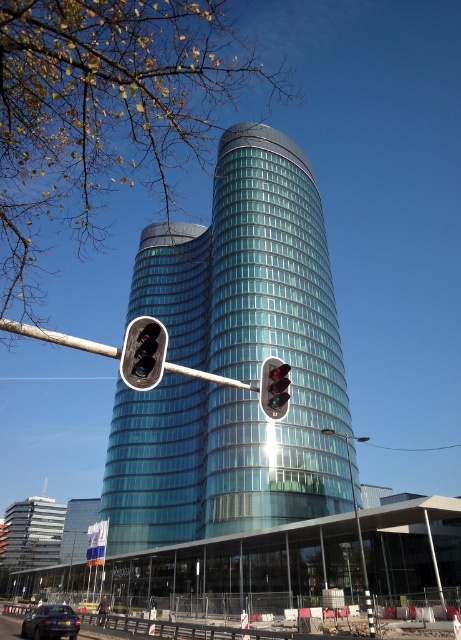
Is glassy teal skyscraper at center to the right of metallic traffic light at left from the viewer's perspective?

Correct, you'll find glassy teal skyscraper at center to the right of metallic traffic light at left.

In the scene shown: Can you confirm if glassy teal skyscraper at center is positioned above metallic traffic light at left?

Correct, glassy teal skyscraper at center is located above metallic traffic light at left.

Is point (193, 456) behind point (30, 326)?

Yes, point (193, 456) is farther from viewer.

What are the coordinates of `glassy teal skyscraper at center` in the screenshot? It's located at (232, 362).

Does point (78, 625) come behind point (278, 417)?

Yes, it is behind point (278, 417).

Does point (27, 636) come in front of point (267, 408)?

No, (27, 636) is behind (267, 408).

Is point (57, 624) closer to viewer compared to point (270, 410)?

No, it is not.

The height and width of the screenshot is (640, 461). Identify the location of metallic blue sedan at lower left. (51, 621).

Which is below, metallic traffic light at left or matte black traffic light at center?

metallic traffic light at left is lower down.

What do you see at coordinates (129, 353) in the screenshot?
I see `metallic traffic light at left` at bounding box center [129, 353].

Does point (158, 342) come closer to viewer compared to point (157, 321)?

That is True.

The width and height of the screenshot is (461, 640). In order to click on metallic traffic light at left in this screenshot , I will do `click(129, 353)`.